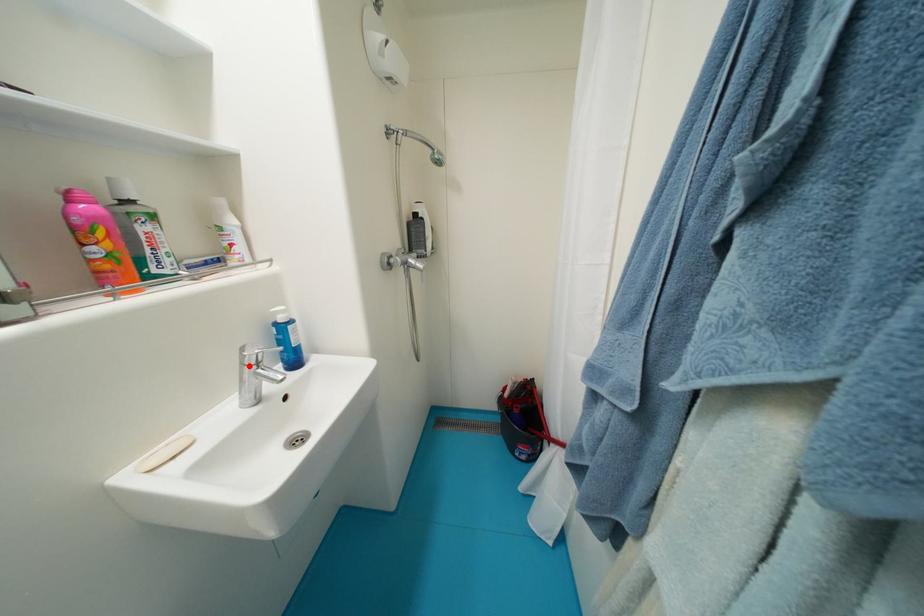
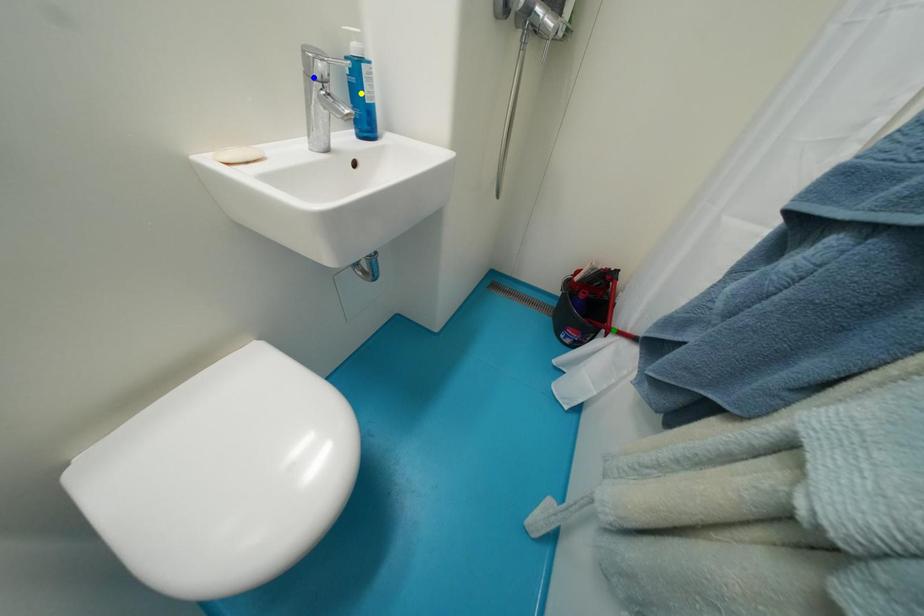
Question: I am providing you with two images of the same scene from different viewpoints. A red point is marked on the first image. You are given multiple points on the second image. Which spot in image 2 lines up with the point in image 1?

Choices:
 (A) green point
 (B) yellow point
 (C) blue point

Answer: (C)